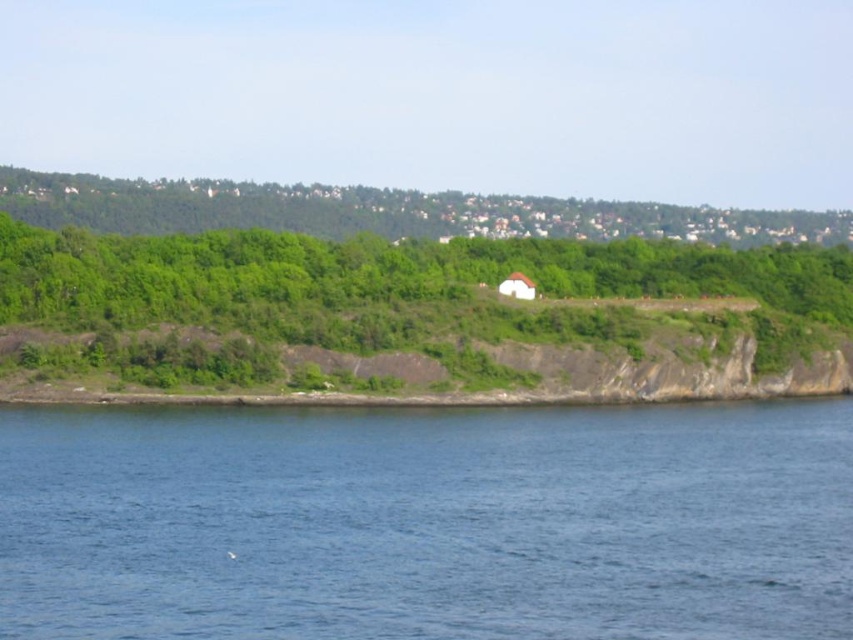
Which of these two, blue liquid water at lower center or green leafy trees at upper center, stands taller?

green leafy trees at upper center

Does point (177, 637) lie in front of point (25, 182)?

Yes, point (177, 637) is closer to viewer.

What do you see at coordinates (427, 522) in the screenshot?
I see `blue liquid water at lower center` at bounding box center [427, 522].

Find the location of a particular element. The width and height of the screenshot is (853, 640). blue liquid water at lower center is located at coordinates (427, 522).